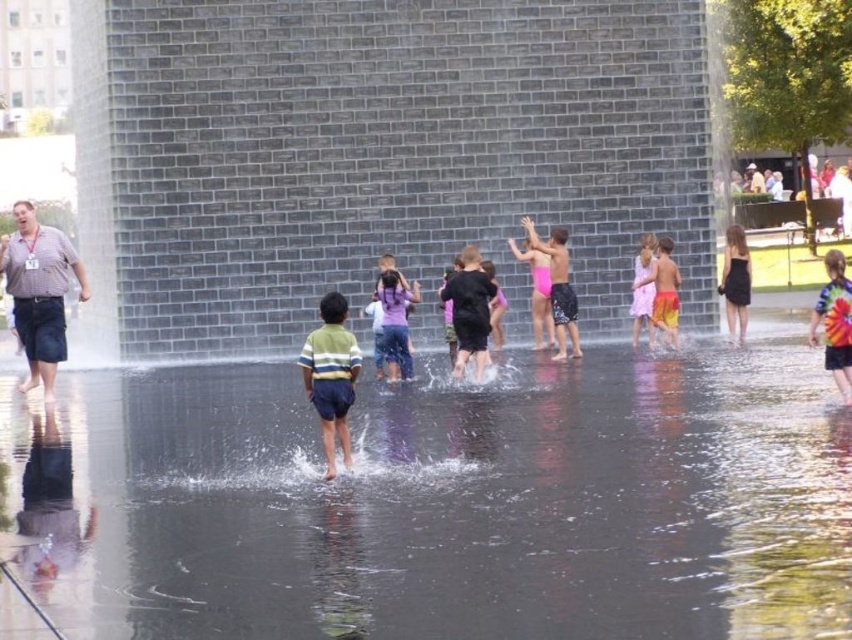
Between point (32, 355) and point (349, 381), which one is positioned in front?

Point (349, 381) is more forward.

How distant is striped shirt shorts at center left from striped cotton shirt at center?

The distance of striped shirt shorts at center left from striped cotton shirt at center is 6.72 meters.

Is point (26, 353) farther from viewer compared to point (327, 445)?

Yes, it is.

Where is `striped shirt shorts at center left`? Image resolution: width=852 pixels, height=640 pixels. striped shirt shorts at center left is located at coordinates (39, 291).

Does clear water at center lie behind striped cotton shirt at center?

No, it is not.

Does point (436, 531) come closer to viewer compared to point (338, 317)?

Yes, point (436, 531) is closer to viewer.

Which is behind, point (534, 600) or point (304, 372)?

Positioned behind is point (304, 372).

Locate an element on the screen. clear water at center is located at coordinates (448, 502).

Is striped cotton shirt at center below tie-dye fabric shorts at center?

Yes.

Is striped cotton shirt at center smaller than tie-dye fabric shorts at center?

Correct, striped cotton shirt at center occupies less space than tie-dye fabric shorts at center.

Which is behind, point (308, 392) or point (836, 349)?

The point (836, 349) is behind.

Identify the location of striped cotton shirt at center. [x=331, y=376].